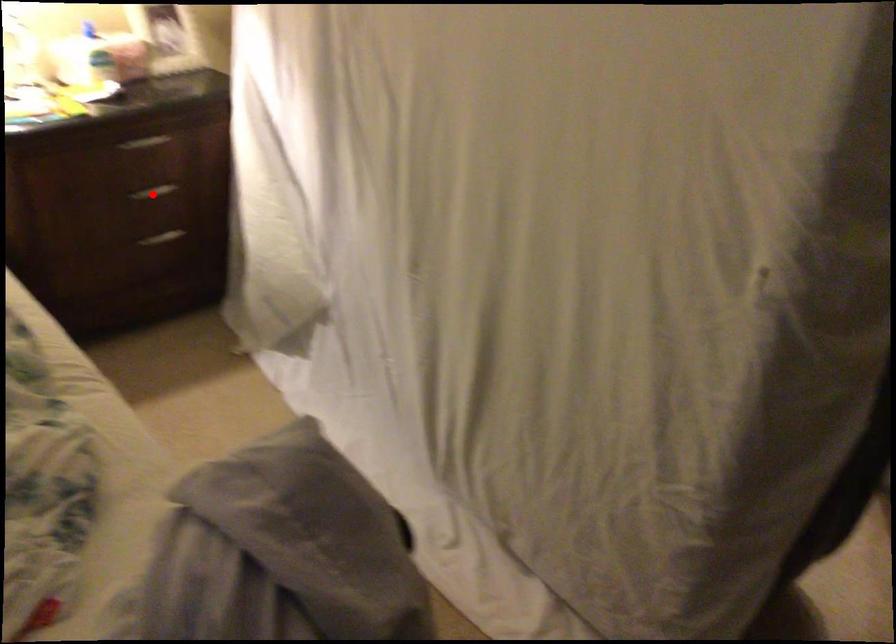
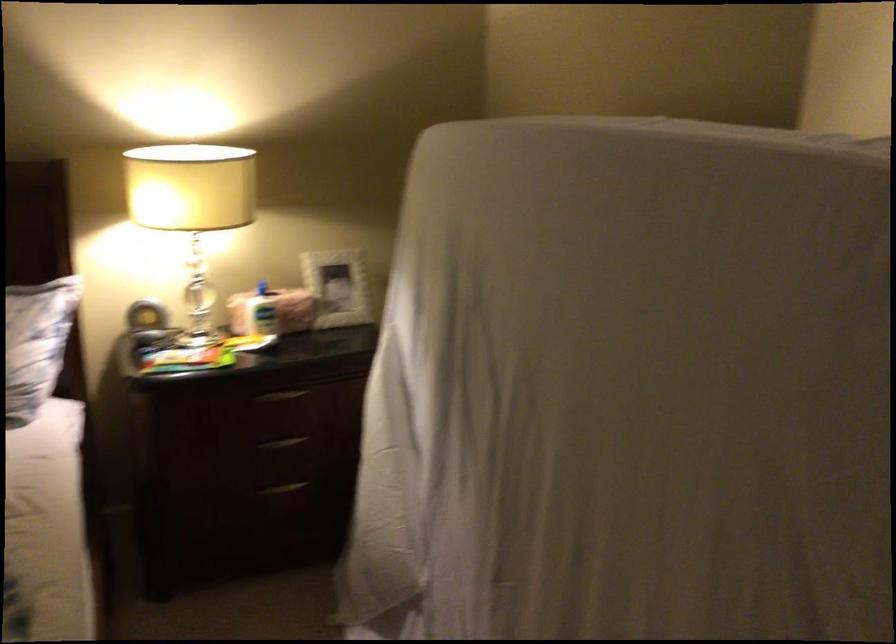
Find the pixel in the second image that matches the highlighted location in the first image.

(282, 442)